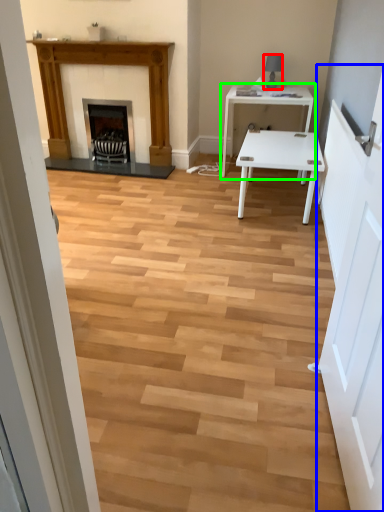
Question: Considering the real-world distances, which object is closest to lamp (highlighted by a red box)? door (highlighted by a blue box) or table (highlighted by a green box).

Choices:
 (A) door
 (B) table

Answer: (B)